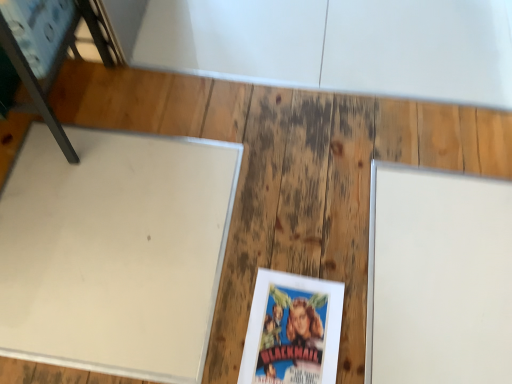
I want to click on vacant location below white matte board at right (from a real-world perspective), so click(444, 278).